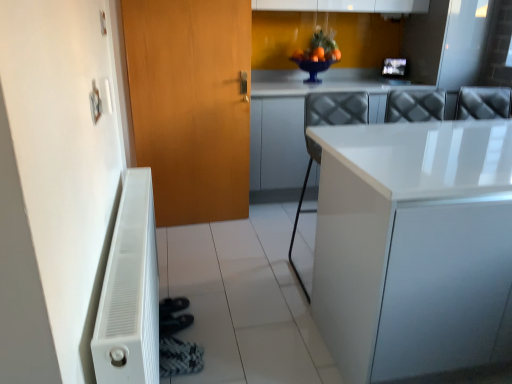
The width and height of the screenshot is (512, 384). Identify the location of vacant space to the right of black textured shoe at lower left. (222, 361).